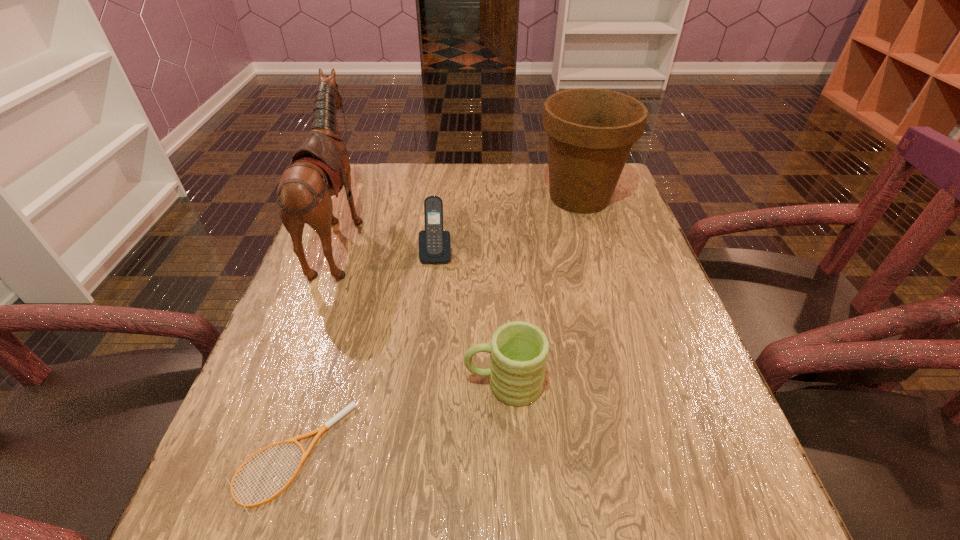
Locate an element on the screen. free spot between the saddle and the flowerpot is located at coordinates (461, 216).

Locate an element on the screen. Image resolution: width=960 pixels, height=540 pixels. object that is the second closest one to the shortest object is located at coordinates (320, 167).

Identify which object is the second closest to the rightmost object. Please provide its 2D coordinates. Your answer should be formatted as a tuple, i.e. [(x, y)], where the tuple contains the x and y coordinates of a point satisfying the conditions above.

[(518, 350)]

The image size is (960, 540). What are the coordinates of `vacant space that satisfies the following two spatial constraints: 1. on the back side of the tennis racket; 2. on the right side of the second tallest object` in the screenshot? It's located at (373, 197).

The height and width of the screenshot is (540, 960). In order to click on free location that satisfies the following two spatial constraints: 1. on the side of the mug with the handle; 2. on the front side of the tennis racket in this screenshot , I will do `click(507, 455)`.

Locate an element on the screen. vacant area in the image that satisfies the following two spatial constraints: 1. on the side of the second shortest object with the handle; 2. on the front side of the shortest object is located at coordinates (507, 455).